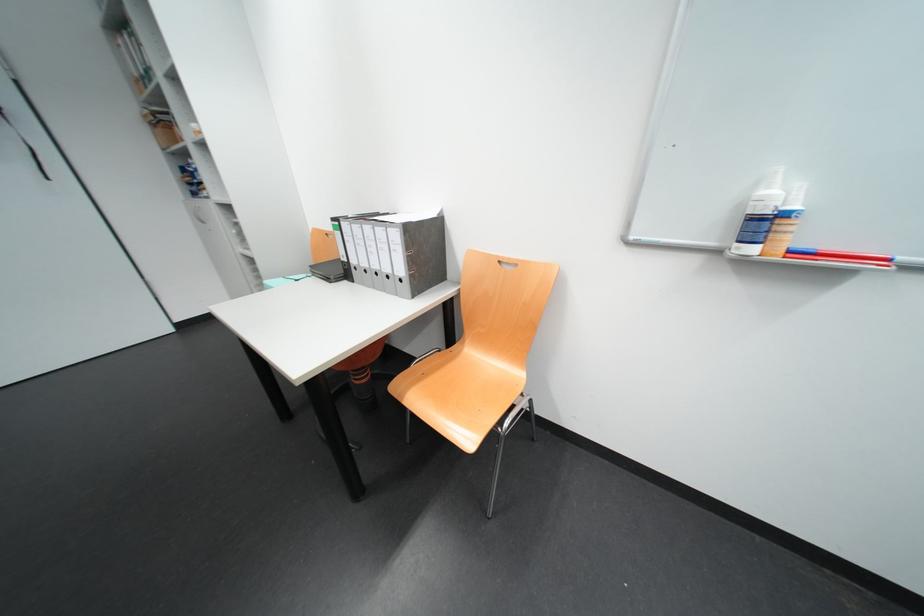
Locate an element on the screen. The width and height of the screenshot is (924, 616). blue spray bottle is located at coordinates (759, 216).